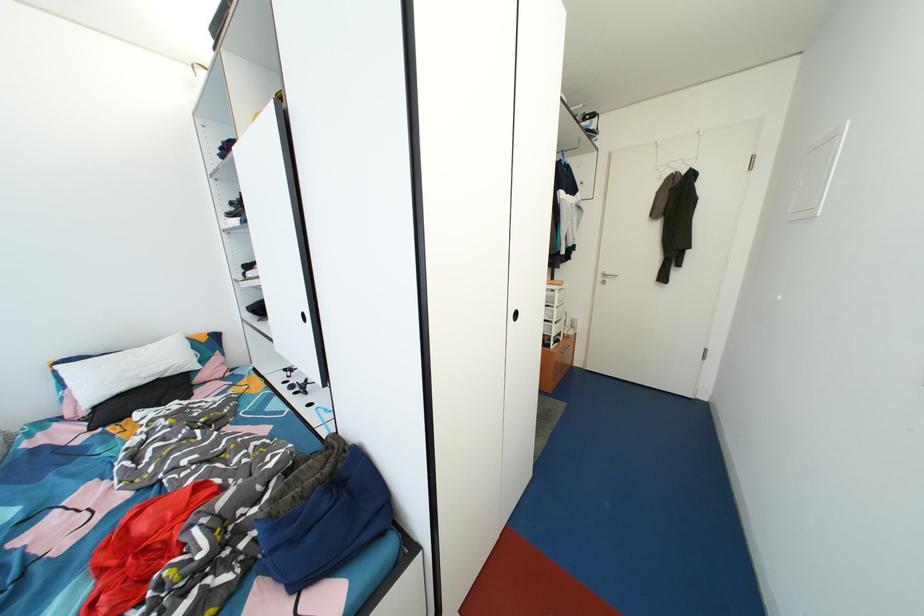
Find where to hang the white hanger hook. Please return your answer as a coordinate pair (x, y).

(658, 177)